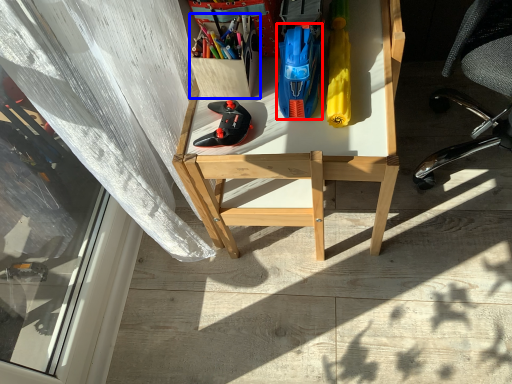
Question: Which point is further to the camera, stationery (highlighted by a red box) or stationery (highlighted by a blue box)?

Choices:
 (A) stationery
 (B) stationery

Answer: (B)